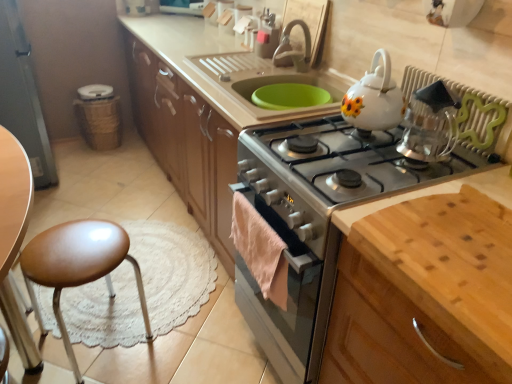
The width and height of the screenshot is (512, 384). What are the coordinates of `free space in front of clear glass kettle at upper right` in the screenshot? It's located at (419, 175).